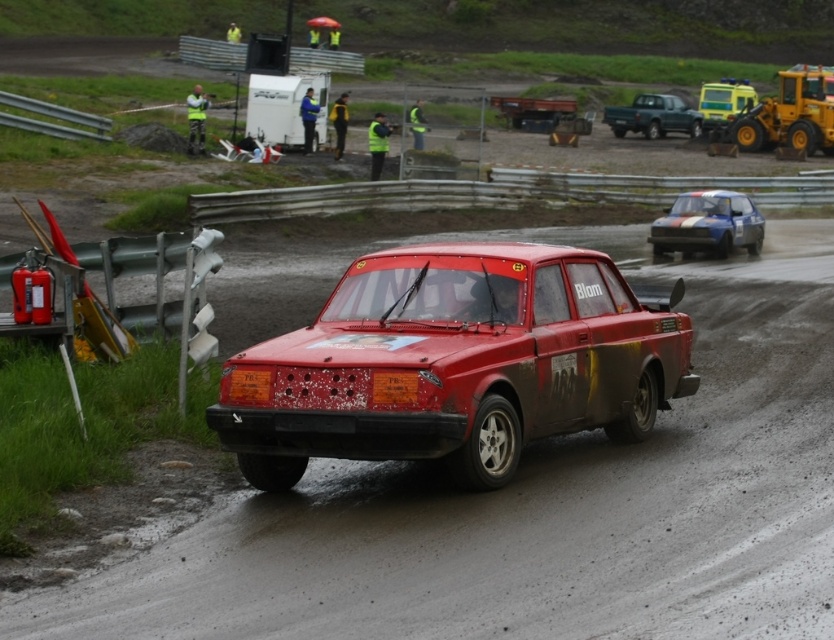
Looking at this image, you are a safety officer at the rally event. You need to quickly locate the yellow reflective vest at upper left and the green matte pickup truck at upper right. Based on the scene, which object is placed higher in the image?

The green matte pickup truck at upper right is positioned over the yellow reflective vest at upper left, so the green matte pickup truck at upper right is higher in the image.

You are a race commentator describing the rally car event. You notice two points in the image at coordinates point (496, 460) and point (192, 90). Which of these points is nearer to the camera?

Point (496, 460) is closer to the viewer than point (192, 90).